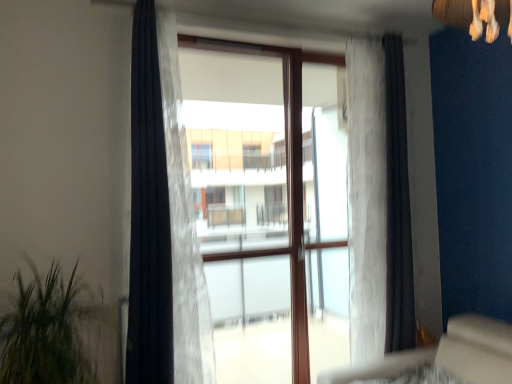
Question: Is white sheer curtain at center, the third curtain positioned from the left, positioned beyond the bounds of transparent glass door at center?

Choices:
 (A) yes
 (B) no

Answer: (A)

Question: Is white sheer curtain at center, the third curtain positioned from the left, far from transparent glass door at center?

Choices:
 (A) yes
 (B) no

Answer: (B)

Question: Does white sheer curtain at center, the third curtain positioned from the left, touch transparent glass door at center?

Choices:
 (A) yes
 (B) no

Answer: (B)

Question: Is white sheer curtain at center, the second curtain in the right-to-left sequence, smaller than transparent glass door at center?

Choices:
 (A) no
 (B) yes

Answer: (B)

Question: Is white sheer curtain at center, the second curtain in the right-to-left sequence, facing away from transparent glass door at center?

Choices:
 (A) yes
 (B) no

Answer: (B)

Question: Could you tell me if white sheer curtain at center, the third curtain positioned from the left, is facing transparent glass door at center?

Choices:
 (A) no
 (B) yes

Answer: (A)

Question: Does translucent fabric curtain at center, marked as the 3th curtain in a right-to-left arrangement, turn towards black fabric curtain at right, the fourth curtain viewed from the left?

Choices:
 (A) no
 (B) yes

Answer: (A)

Question: Considering the relative sizes of translucent fabric curtain at center, marked as the 3th curtain in a right-to-left arrangement, and black fabric curtain at right, the fourth curtain viewed from the left, in the image provided, is translucent fabric curtain at center, marked as the 3th curtain in a right-to-left arrangement, taller than black fabric curtain at right, the fourth curtain viewed from the left,?

Choices:
 (A) no
 (B) yes

Answer: (A)

Question: Does translucent fabric curtain at center, the second curtain when ordered from left to right, lie in front of black fabric curtain at right, the fourth curtain viewed from the left?

Choices:
 (A) yes
 (B) no

Answer: (A)

Question: From a real-world perspective, is translucent fabric curtain at center, the second curtain when ordered from left to right, physically below black fabric curtain at right, which appears as the 1th curtain when viewed from the right?

Choices:
 (A) no
 (B) yes

Answer: (A)

Question: From a real-world perspective, is translucent fabric curtain at center, the second curtain when ordered from left to right, located higher than black fabric curtain at right, which appears as the 1th curtain when viewed from the right?

Choices:
 (A) yes
 (B) no

Answer: (A)

Question: Is translucent fabric curtain at center, marked as the 3th curtain in a right-to-left arrangement, at the right side of black fabric curtain at right, which appears as the 1th curtain when viewed from the right?

Choices:
 (A) no
 (B) yes

Answer: (A)

Question: From a real-world perspective, is black sheer curtain at left, positioned as the 1th curtain in left-to-right order, positioned over black fabric curtain at right, which appears as the 1th curtain when viewed from the right, based on gravity?

Choices:
 (A) yes
 (B) no

Answer: (A)